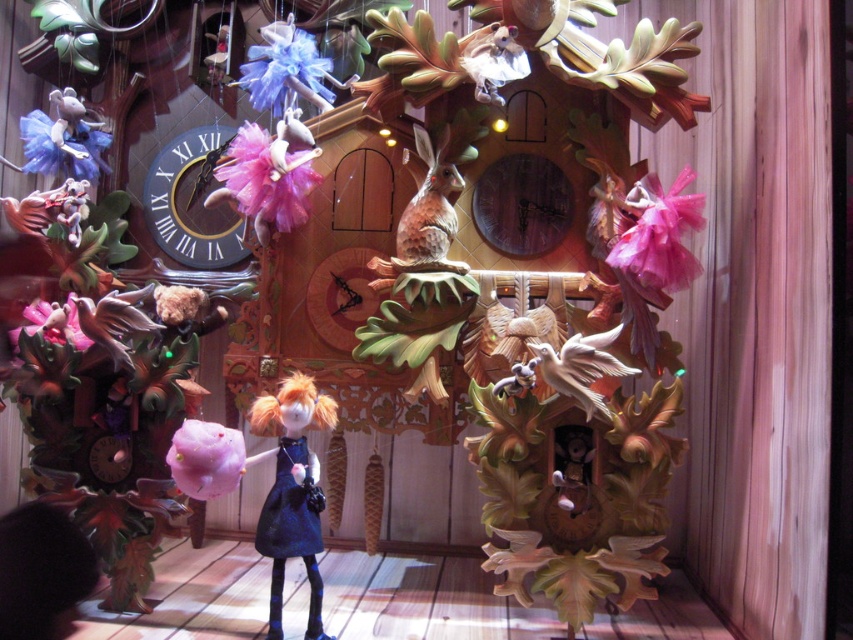
Is purple tulle flower at upper center to the left of pink tulle flower at center from the viewer's perspective?

Incorrect, purple tulle flower at upper center is not on the left side of pink tulle flower at center.

Does purple tulle flower at upper center have a smaller size compared to pink tulle flower at center?

No, purple tulle flower at upper center is not smaller than pink tulle flower at center.

Is point (314, 154) less distant than point (27, 324)?

That is True.

You are a GUI agent. You are given a task and a screenshot of the screen. Output one action in this format:
    pyautogui.click(x=<x>, y=<y>)
    Task: Click on the purple tulle flower at upper center
    This screenshot has width=853, height=640.
    Given the screenshot: What is the action you would take?
    pyautogui.click(x=270, y=173)

Does pink tulle flower at upper right appear over wooden carved bird at center?

Yes.

Between point (643, 230) and point (532, 344), which one is positioned behind?

Point (532, 344)

Where is `pink tulle flower at upper right`? The image size is (853, 640). pink tulle flower at upper right is located at coordinates (659, 234).

Looking at this image, is matte black clock at left below wooden duckling at lower center?

No.

Is matte black clock at left to the right of wooden duckling at lower center from the viewer's perspective?

In fact, matte black clock at left is to the left of wooden duckling at lower center.

This screenshot has width=853, height=640. What do you see at coordinates (190, 204) in the screenshot?
I see `matte black clock at left` at bounding box center [190, 204].

Find the location of a particular element. matte black clock at left is located at coordinates (190, 204).